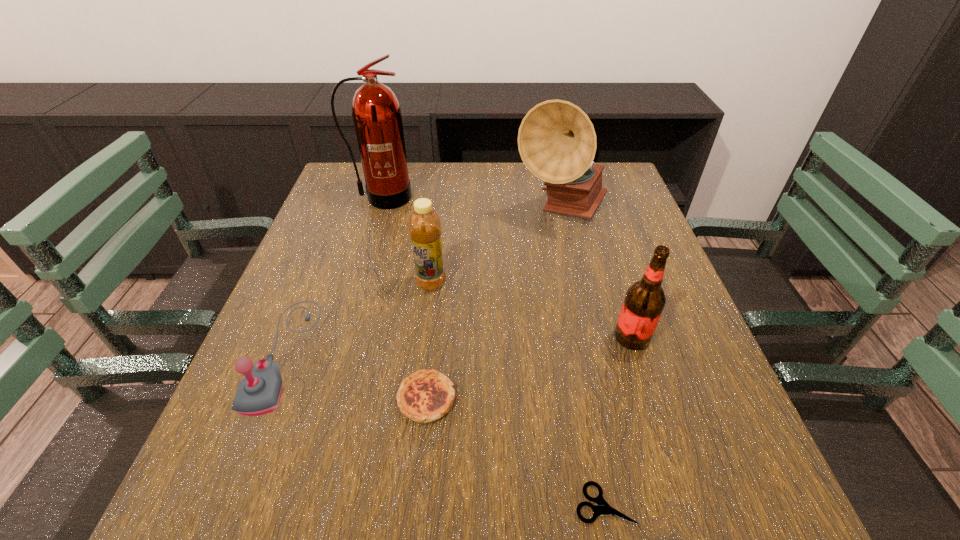
Image resolution: width=960 pixels, height=540 pixels. I want to click on phonograph record located at the right edge, so click(x=557, y=142).

Locate an element on the screen. This screenshot has height=540, width=960. root beer that is at the right edge is located at coordinates (644, 301).

Where is `object present at the far left corner`? This screenshot has width=960, height=540. object present at the far left corner is located at coordinates (376, 112).

The image size is (960, 540). In order to click on object present at the far right corner in this screenshot , I will do `click(557, 142)`.

Locate an element on the screen. free space at the far edge of the desktop is located at coordinates (523, 178).

The height and width of the screenshot is (540, 960). I want to click on vacant space at the near edge of the desktop, so point(635,487).

Where is `vacant space at the left edge of the desktop`? vacant space at the left edge of the desktop is located at coordinates (355, 211).

The height and width of the screenshot is (540, 960). What are the coordinates of `free spot at the right edge of the desktop` in the screenshot? It's located at (694, 442).

Find the location of a particular element. The image size is (960, 540). free spot at the near left corner of the desktop is located at coordinates click(194, 526).

Where is `empty space that is in between the third farthest object and the sixth tallest object`? The width and height of the screenshot is (960, 540). empty space that is in between the third farthest object and the sixth tallest object is located at coordinates (429, 341).